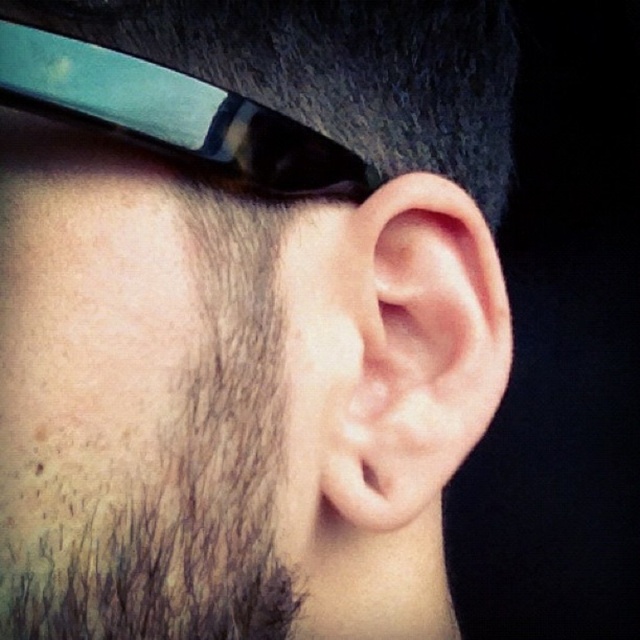
Question: Does dark brown hair at lower left have a lesser width compared to metallic blue goggles at upper left?

Choices:
 (A) yes
 (B) no

Answer: (A)

Question: Among these points, which one is nearest to the camera?

Choices:
 (A) (369, 220)
 (B) (65, 112)
 (C) (145, 568)

Answer: (B)

Question: Among these points, which one is nearest to the camera?

Choices:
 (A) (416, 499)
 (B) (104, 579)

Answer: (B)

Question: Which point appears closest to the camera in this image?

Choices:
 (A) (337, 477)
 (B) (209, 234)

Answer: (B)

Question: From the image, what is the correct spatial relationship of dark brown hair at lower left in relation to metallic blue goggles at upper left?

Choices:
 (A) right
 (B) left

Answer: (B)

Question: Can you confirm if dark brown hair at lower left is positioned above pink flesh-colored ear at center?

Choices:
 (A) no
 (B) yes

Answer: (A)